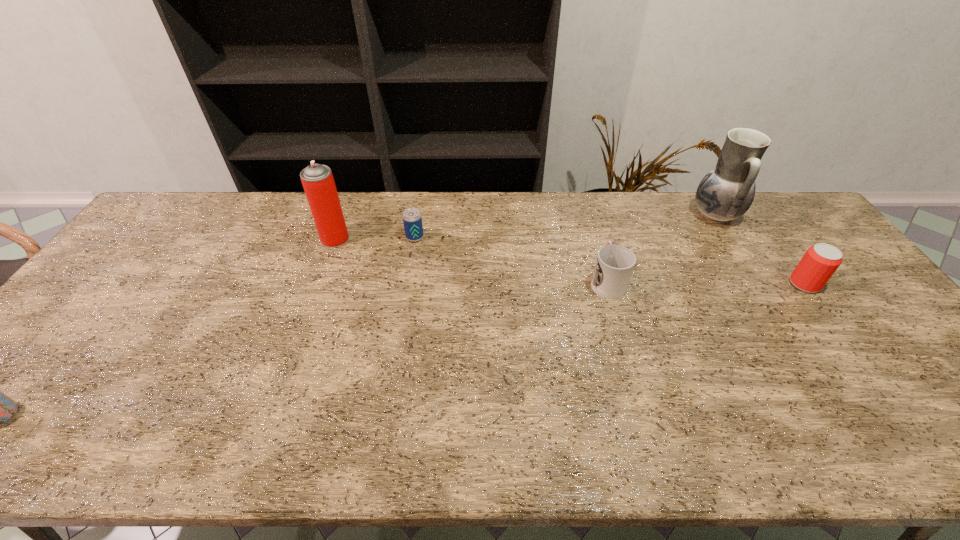
Locate an element on the screen. The height and width of the screenshot is (540, 960). free space at the far edge of the desktop is located at coordinates (298, 234).

Locate an element on the screen. This screenshot has width=960, height=540. vacant space at the near edge of the desktop is located at coordinates (356, 432).

Find the location of a particular element. The width and height of the screenshot is (960, 540). free space at the left edge of the desktop is located at coordinates (67, 382).

The width and height of the screenshot is (960, 540). Identify the location of vacant area at the right edge. (946, 414).

This screenshot has width=960, height=540. In the image, there is a desktop. What are the coordinates of `vacant space at the far left corner` in the screenshot? It's located at (157, 222).

The image size is (960, 540). Find the location of `vacant point located between the pitcher and the second beer can from right to left`. vacant point located between the pitcher and the second beer can from right to left is located at coordinates tap(565, 226).

The width and height of the screenshot is (960, 540). I want to click on vacant space that's between the fifth object from left to right and the cup, so click(661, 248).

You are a GUI agent. You are given a task and a screenshot of the screen. Output one action in this format:
    pyautogui.click(x=<x>, y=<y>)
    Task: Click on the empty space between the fourth object from left to right and the aerosol can
    This screenshot has width=960, height=540.
    Given the screenshot: What is the action you would take?
    pyautogui.click(x=471, y=260)

What are the coordinates of `vacant area between the second beer can from left to right and the second object from right to left` in the screenshot? It's located at (565, 226).

The image size is (960, 540). What are the coordinates of `free space between the fifth object from left to right and the farthest beer can` in the screenshot? It's located at (565, 226).